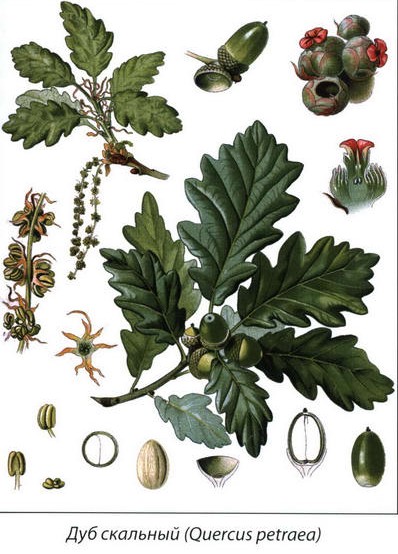
The height and width of the screenshot is (554, 398). In order to click on green and red plant right center in this screenshot , I will do `click(356, 188)`, `click(356, 151)`.